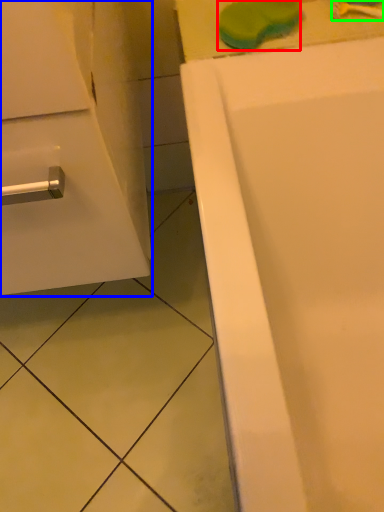
Question: Based on their relative distances, which object is nearer to soap (highlighted by a red box)? Choose from bathroom cabinet (highlighted by a blue box) and toothbrush (highlighted by a green box).

Choices:
 (A) bathroom cabinet
 (B) toothbrush

Answer: (B)